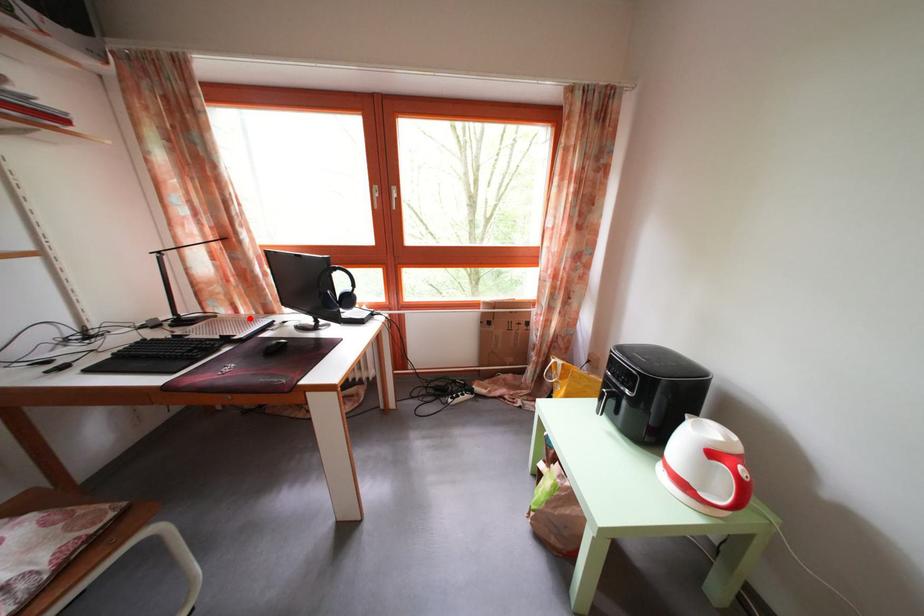
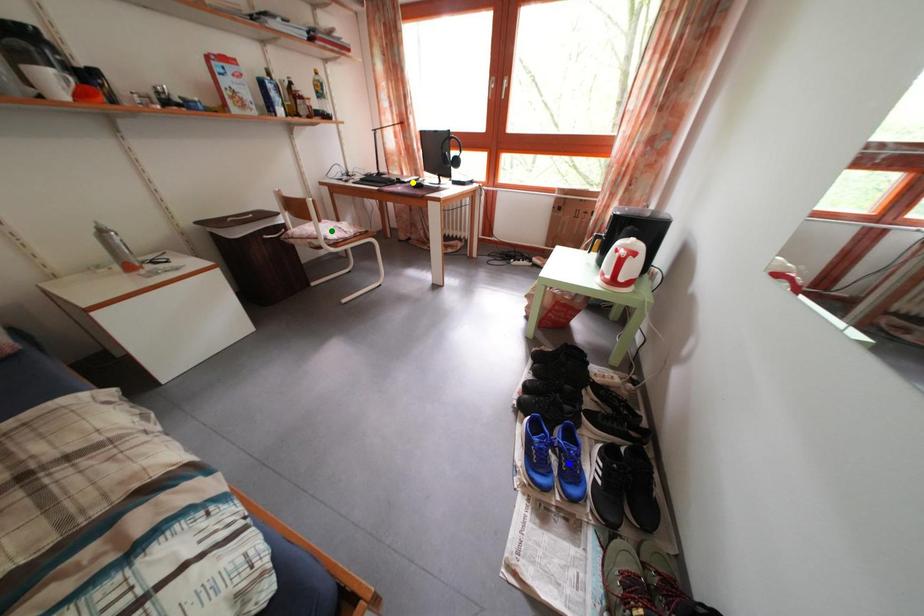
Question: I am providing you with two images of the same scene from different viewpoints. A red point is marked on the first image. You are given multiple points on the second image. Which point in image 2 represents the same 3d spot as the red point in image 1?

Choices:
 (A) green point
 (B) yellow point
 (C) blue point

Answer: (B)